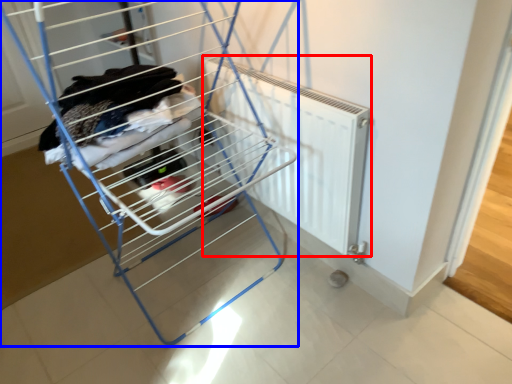
Question: Which object is closer to the camera taking this photo, radiator (highlighted by a red box) or furniture (highlighted by a blue box)?

Choices:
 (A) radiator
 (B) furniture

Answer: (B)